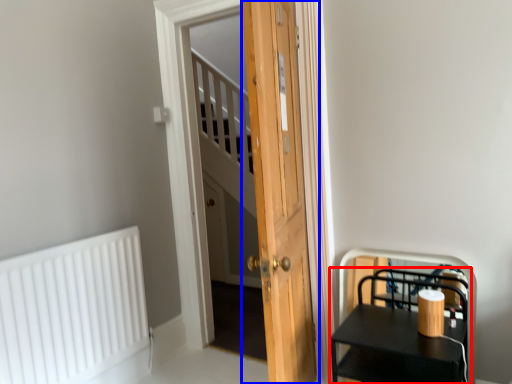
Question: Which object is closer to the camera taking this photo, furniture (highlighted by a red box) or door (highlighted by a blue box)?

Choices:
 (A) furniture
 (B) door

Answer: (B)